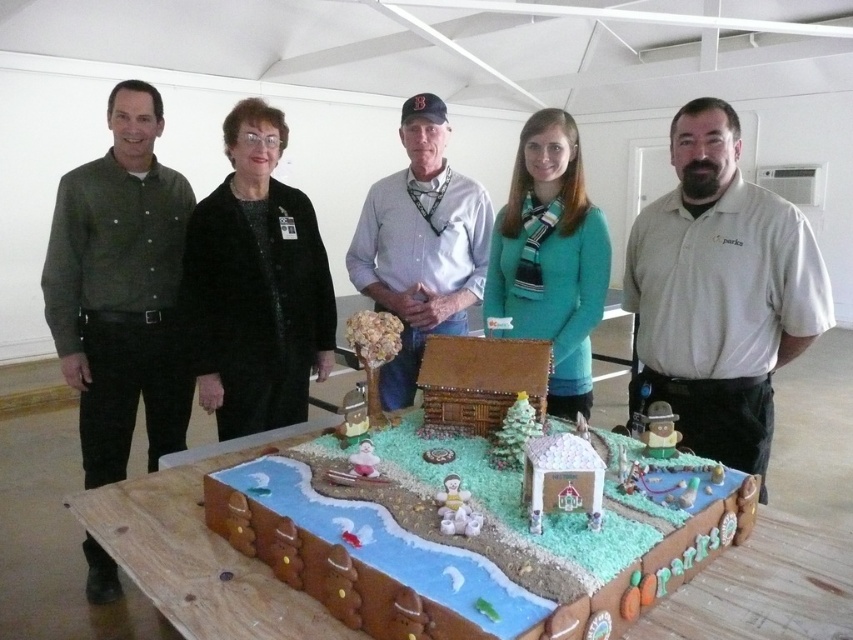
Which is in front, point (256, 588) or point (115, 298)?

Positioned in front is point (256, 588).

Is point (834, 563) in front of point (79, 346)?

Yes.

The width and height of the screenshot is (853, 640). Describe the element at coordinates (200, 552) in the screenshot. I see `brown sugar-coated gingerbread house at center` at that location.

Find the location of a particular element. The height and width of the screenshot is (640, 853). brown sugar-coated gingerbread house at center is located at coordinates (200, 552).

Measure the distance between gray cotton shirt at center and black fuzzy coat at center.

A distance of 4.01 feet exists between gray cotton shirt at center and black fuzzy coat at center.

Between gray cotton shirt at center and black fuzzy coat at center, which one is positioned lower?

gray cotton shirt at center is below.

This screenshot has width=853, height=640. Find the location of `gray cotton shirt at center`. gray cotton shirt at center is located at coordinates [720, 292].

Does gray cotton shirt at center have a greater height compared to teal matte sweater at center?

Yes, gray cotton shirt at center is taller than teal matte sweater at center.

What are the coordinates of `gray cotton shirt at center` in the screenshot? It's located at (720, 292).

This screenshot has height=640, width=853. Find the location of `gray cotton shirt at center`. gray cotton shirt at center is located at coordinates (720, 292).